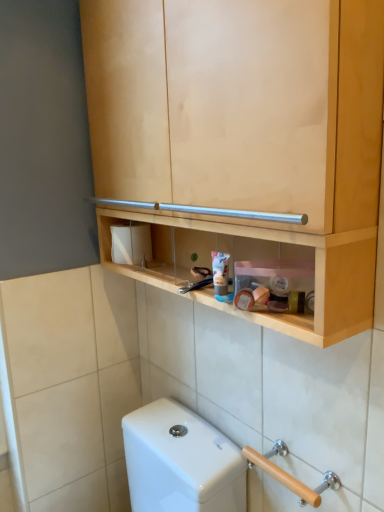
Question: Can you confirm if wooden at lower right is bigger than natural wood cabinet at upper center?

Choices:
 (A) yes
 (B) no

Answer: (B)

Question: Does wooden at lower right lie in front of natural wood cabinet at upper center?

Choices:
 (A) yes
 (B) no

Answer: (B)

Question: Can you confirm if wooden at lower right is taller than natural wood cabinet at upper center?

Choices:
 (A) no
 (B) yes

Answer: (A)

Question: Is wooden at lower right in contact with natural wood cabinet at upper center?

Choices:
 (A) no
 (B) yes

Answer: (A)

Question: Is wooden at lower right far from natural wood cabinet at upper center?

Choices:
 (A) no
 (B) yes

Answer: (A)

Question: From the image's perspective, is wooden at lower right located above or below white matte toilet paper at center?

Choices:
 (A) above
 (B) below

Answer: (B)

Question: From their relative heights in the image, would you say wooden at lower right is taller or shorter than white matte toilet paper at center?

Choices:
 (A) short
 (B) tall

Answer: (A)

Question: Is wooden at lower right wider or thinner than white matte toilet paper at center?

Choices:
 (A) thin
 (B) wide

Answer: (A)

Question: Looking at the image, does wooden at lower right seem bigger or smaller compared to white matte toilet paper at center?

Choices:
 (A) small
 (B) big

Answer: (A)

Question: Is wooden at lower right bigger or smaller than natural wood cabinet at upper center?

Choices:
 (A) small
 (B) big

Answer: (A)

Question: In terms of height, does wooden at lower right look taller or shorter compared to natural wood cabinet at upper center?

Choices:
 (A) tall
 (B) short

Answer: (B)

Question: Is wooden at lower right inside the boundaries of natural wood cabinet at upper center, or outside?

Choices:
 (A) inside
 (B) outside

Answer: (B)

Question: From a real-world perspective, is wooden at lower right physically located above or below natural wood cabinet at upper center?

Choices:
 (A) below
 (B) above

Answer: (A)

Question: Does point (299, 181) appear closer or farther from the camera than point (296, 480)?

Choices:
 (A) farther
 (B) closer

Answer: (B)

Question: Is natural wood cabinet at upper center bigger or smaller than wooden at lower right?

Choices:
 (A) big
 (B) small

Answer: (A)